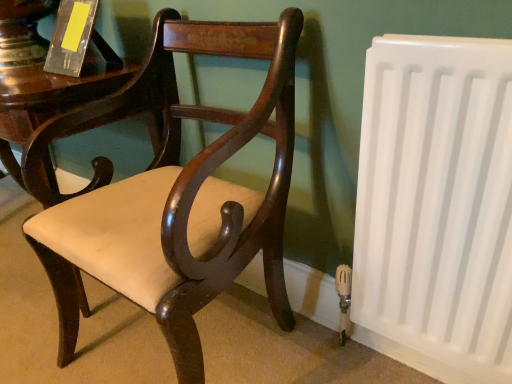
Question: From a real-world perspective, is white plastic radiator at right beneath matte wood chair at center?

Choices:
 (A) yes
 (B) no

Answer: (A)

Question: Does white plastic radiator at right have a lesser width compared to matte wood chair at center?

Choices:
 (A) yes
 (B) no

Answer: (A)

Question: Is white plastic radiator at right oriented towards matte wood chair at center?

Choices:
 (A) no
 (B) yes

Answer: (A)

Question: Does white plastic radiator at right appear on the left side of matte wood chair at center?

Choices:
 (A) yes
 (B) no

Answer: (B)

Question: Is the depth of white plastic radiator at right less than that of matte wood chair at center?

Choices:
 (A) yes
 (B) no

Answer: (B)

Question: From the image's perspective, is matte wood chair at center located above or below white plastic radiator at right?

Choices:
 (A) above
 (B) below

Answer: (A)

Question: In terms of width, does matte wood chair at center look wider or thinner when compared to white plastic radiator at right?

Choices:
 (A) wide
 (B) thin

Answer: (A)

Question: Looking at the image, does matte wood chair at center seem bigger or smaller compared to white plastic radiator at right?

Choices:
 (A) big
 (B) small

Answer: (A)

Question: Is matte wood chair at center in front of or behind white plastic radiator at right in the image?

Choices:
 (A) behind
 (B) front

Answer: (B)

Question: Would you say translucent acrylic book at upper left is to the left or to the right of white plastic radiator at right in the picture?

Choices:
 (A) right
 (B) left

Answer: (B)

Question: Is point (69, 13) closer or farther from the camera than point (463, 261)?

Choices:
 (A) closer
 (B) farther

Answer: (B)

Question: Is translucent acrylic book at upper left wider or thinner than white plastic radiator at right?

Choices:
 (A) thin
 (B) wide

Answer: (B)

Question: Considering the positions of translucent acrylic book at upper left and white plastic radiator at right in the image, is translucent acrylic book at upper left bigger or smaller than white plastic radiator at right?

Choices:
 (A) small
 (B) big

Answer: (A)

Question: Relative to translucent acrylic book at upper left, is white plastic radiator at right in front or behind?

Choices:
 (A) behind
 (B) front

Answer: (B)

Question: From the image's perspective, relative to translucent acrylic book at upper left, is white plastic radiator at right above or below?

Choices:
 (A) above
 (B) below

Answer: (B)